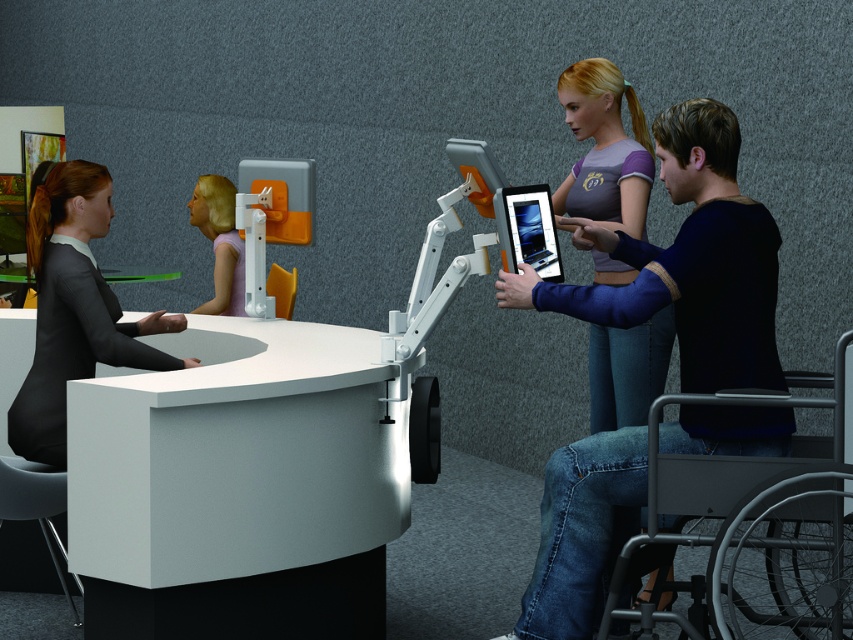
Is metallic blue wheelchair at right taller than silver metallic wheelchair at lower right?

Yes, metallic blue wheelchair at right is taller than silver metallic wheelchair at lower right.

Who is taller, metallic blue wheelchair at right or silver metallic wheelchair at lower right?

With more height is metallic blue wheelchair at right.

This screenshot has width=853, height=640. What do you see at coordinates (688, 260) in the screenshot?
I see `metallic blue wheelchair at right` at bounding box center [688, 260].

Identify the location of metallic blue wheelchair at right. (688, 260).

In the scene shown: Is black fabric suit at left below purple matte shirt at upper right?

Result: Yes.

Who is shorter, black fabric suit at left or purple matte shirt at upper right?

With less height is purple matte shirt at upper right.

What do you see at coordinates (74, 308) in the screenshot? The width and height of the screenshot is (853, 640). I see `black fabric suit at left` at bounding box center [74, 308].

The height and width of the screenshot is (640, 853). What are the coordinates of `black fabric suit at left` in the screenshot? It's located at (74, 308).

What are the coordinates of `white glossy information desk at left` in the screenshot? It's located at (241, 490).

Can you confirm if white glossy information desk at left is smaller than pastel purple fabric at upper center?

Actually, white glossy information desk at left might be larger than pastel purple fabric at upper center.

In the scene shown: Who is more forward, (338, 502) or (227, 237)?

Positioned in front is point (338, 502).

Where is `white glossy information desk at left`? white glossy information desk at left is located at coordinates (241, 490).